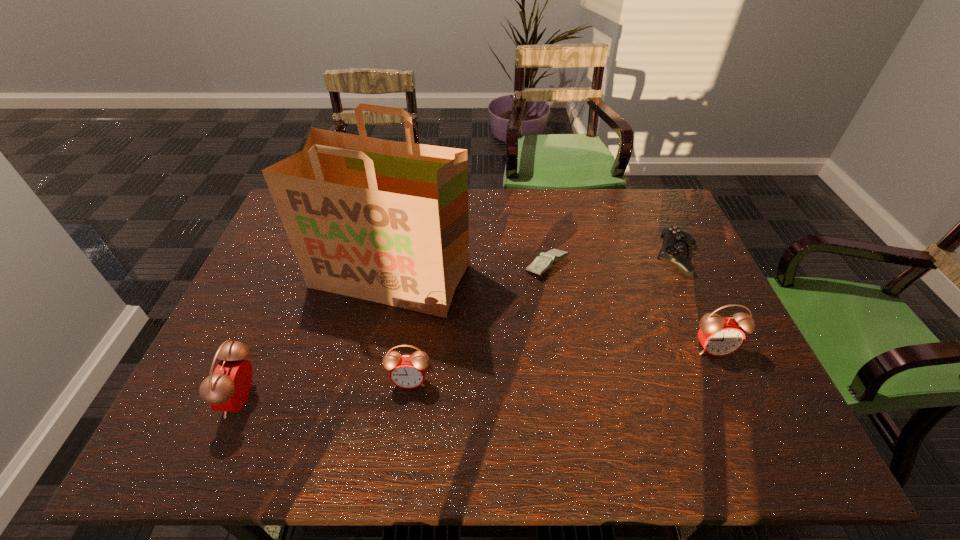
Find the location of a particular element. The image size is (960, 540). the leftmost alarm clock is located at coordinates (227, 389).

The width and height of the screenshot is (960, 540). I want to click on the fourth tallest object, so click(x=406, y=371).

Find the location of a particular element. The width and height of the screenshot is (960, 540). the shortest alarm clock is located at coordinates (406, 371).

Image resolution: width=960 pixels, height=540 pixels. What are the coordinates of `the rightmost alarm clock` in the screenshot? It's located at pos(719,336).

Where is `the second tallest alarm clock`? This screenshot has height=540, width=960. the second tallest alarm clock is located at coordinates (719, 336).

Locate an element on the screen. Image resolution: width=960 pixels, height=540 pixels. the fifth tallest object is located at coordinates (675, 241).

Where is `the tallest object`? This screenshot has width=960, height=540. the tallest object is located at coordinates (386, 221).

Locate an element on the screen. the shortest object is located at coordinates (545, 261).

The image size is (960, 540). Identify the location of diary. tap(545, 261).

I want to click on blank area located 0.080m on the clock face of the leftmost alarm clock, so click(x=193, y=399).